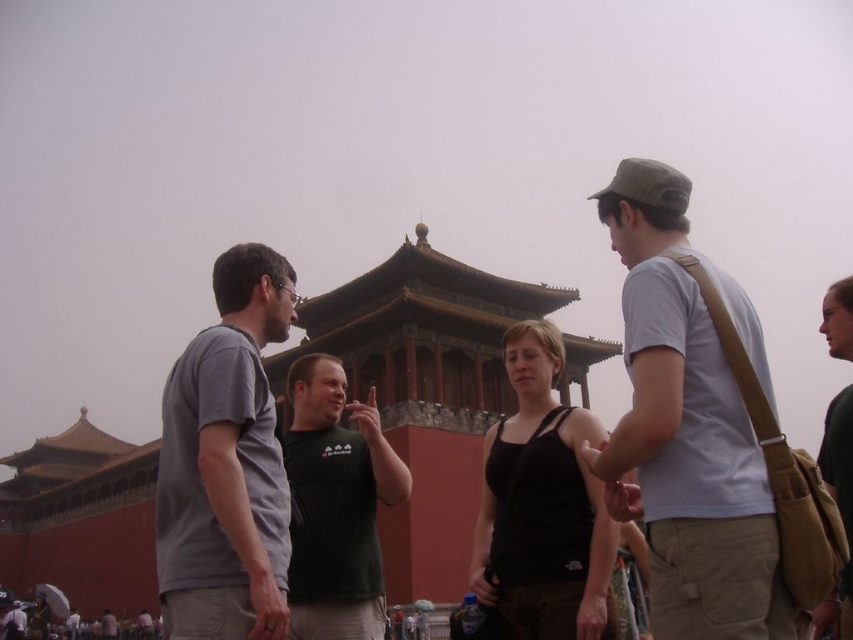
Question: Does black tank top at center have a larger size compared to dark green t-shirt at center?

Choices:
 (A) yes
 (B) no

Answer: (B)

Question: Does light gray cotton t-shirt at center have a smaller size compared to dark green t-shirt at center?

Choices:
 (A) no
 (B) yes

Answer: (A)

Question: Which point is closer to the camera?

Choices:
 (A) gray cotton t-shirt at center
 (B) brown leather backpack at right

Answer: (B)

Question: Which of the following is the farthest from the observer?

Choices:
 (A) black tank top at center
 (B) light gray cotton t-shirt at center
 (C) dark green t-shirt at center
 (D) reddish-brown wood at center

Answer: (D)

Question: Which object is closer to the camera taking this photo?

Choices:
 (A) black tank top at center
 (B) brown leather backpack at right

Answer: (B)

Question: Can you confirm if dark green t-shirt at center is thinner than brown leather backpack at right?

Choices:
 (A) no
 (B) yes

Answer: (B)